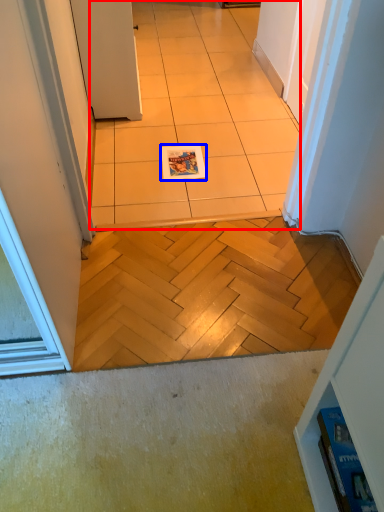
Question: Which of the following is the closest to the observer, ceramic tile (highlighted by a red box) or magazine (highlighted by a blue box)?

Choices:
 (A) ceramic tile
 (B) magazine

Answer: (A)